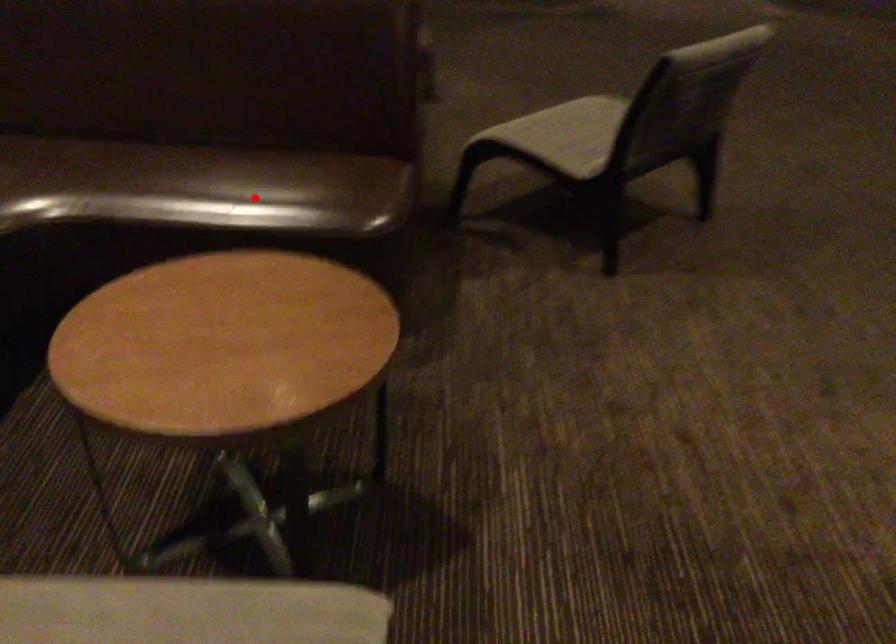
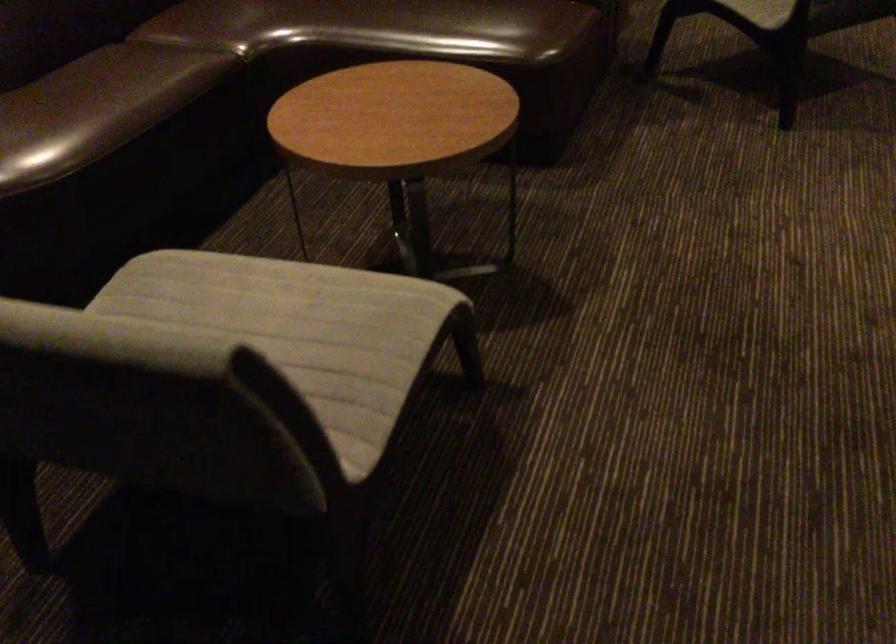
Find the pixel in the second image that matches the highlighted location in the first image.

(444, 26)